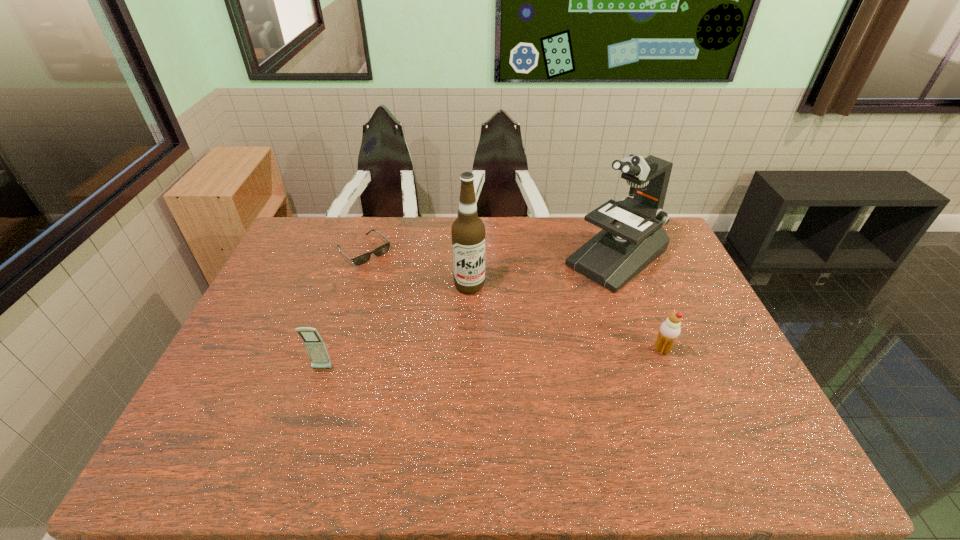
This screenshot has width=960, height=540. What are the coordinates of `cellular telephone` in the screenshot? It's located at (315, 346).

Where is `icecream`? The height and width of the screenshot is (540, 960). icecream is located at coordinates (669, 330).

Identify the location of microscope. (632, 237).

This screenshot has height=540, width=960. I want to click on sunglasses, so click(382, 249).

I want to click on the third object from left to right, so click(x=468, y=231).

Find the location of a particular element. free space located at the front with a straw on the fourth farthest object is located at coordinates (631, 350).

Locate an element on the screen. vacant space located 0.120m at the front with a straw on the fourth farthest object is located at coordinates (609, 350).

At what (x,y) coordinates should I click in order to perform the action: click on vacant space situated 0.230m at the front with a straw on the fourth farthest object. Please return your answer as a coordinate pair (x, y). The height and width of the screenshot is (540, 960). Looking at the image, I should click on (568, 350).

The height and width of the screenshot is (540, 960). Identify the location of vacant space located 0.140m through the eyepieces of the microscope. (557, 303).

At what (x,y) coordinates should I click in order to perform the action: click on free space located 0.180m through the eyepieces of the microscope. Please return your answer as a coordinate pair (x, y). Looking at the image, I should click on (548, 309).